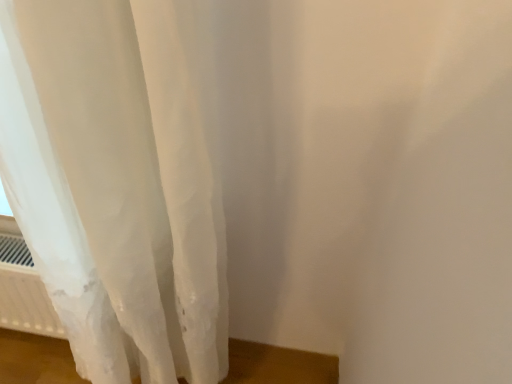
What do you see at coordinates (24, 292) in the screenshot?
I see `white plastic radiator at lower left` at bounding box center [24, 292].

The height and width of the screenshot is (384, 512). In order to click on white plastic radiator at lower left in this screenshot , I will do `click(24, 292)`.

In order to face white plastic radiator at lower left, should I rotate leftwards or rightwards?

Turn left approximately 27.654 degrees to face it.

The width and height of the screenshot is (512, 384). Find the location of `white plastic radiator at lower left`. white plastic radiator at lower left is located at coordinates (24, 292).